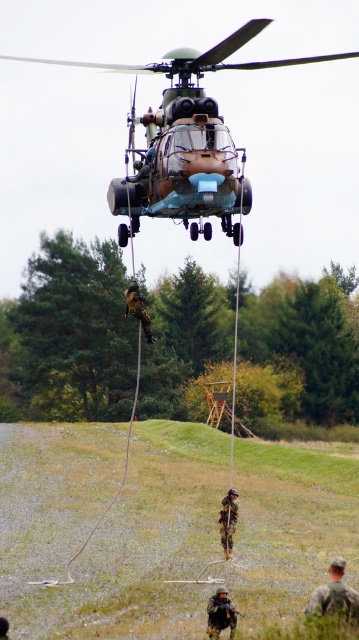
Is camouflage fabric helicopter at upper center taller than camouflage fabric soldier at center?

Correct, camouflage fabric helicopter at upper center is much taller as camouflage fabric soldier at center.

Is point (280, 67) more distant than point (147, 333)?

Yes, point (280, 67) is farther from viewer.

Is point (204, 67) farther from viewer compared to point (141, 324)?

No, it is not.

At what (x,y) coordinates should I click in order to perform the action: click on camouflage fabric helicopter at upper center. Please return your answer as a coordinate pair (x, y). The width and height of the screenshot is (359, 640). Looking at the image, I should click on (193, 72).

Between point (224, 531) and point (133, 300), which one is positioned behind?

Point (224, 531)

Is camouflage fabric uniform at center above camouflage fabric soldier at center?

No, camouflage fabric uniform at center is not above camouflage fabric soldier at center.

Is point (229, 497) positioned in front of point (137, 300)?

That is False.

Locate an element on the screen. The height and width of the screenshot is (640, 359). camouflage fabric uniform at center is located at coordinates (227, 522).

The width and height of the screenshot is (359, 640). Describe the element at coordinates (221, 614) in the screenshot. I see `camouflage fabric helmet at center` at that location.

Can you confirm if camouflage fabric helmet at center is positioned to the right of camouflage fabric uniform at center?

In fact, camouflage fabric helmet at center is to the left of camouflage fabric uniform at center.

Is point (227, 620) behind point (230, 499)?

No, (227, 620) is in front of (230, 499).

This screenshot has height=640, width=359. In order to click on camouflage fabric helmet at center in this screenshot , I will do `click(221, 614)`.